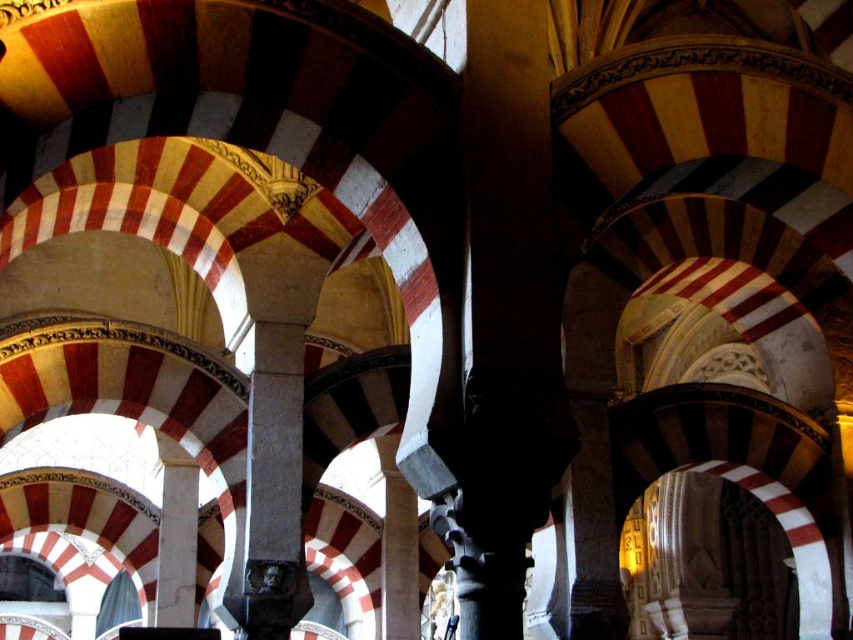
Which is more to the right, black polished stone column at center or dark gray stone column at center?

black polished stone column at center is more to the right.

Who is positioned more to the left, black polished stone column at center or dark gray stone column at center?

dark gray stone column at center

Is point (506, 417) positioned before point (282, 474)?

Yes, point (506, 417) is in front of point (282, 474).

This screenshot has height=640, width=853. Find the location of `black polished stone column at center`. black polished stone column at center is located at coordinates (505, 317).